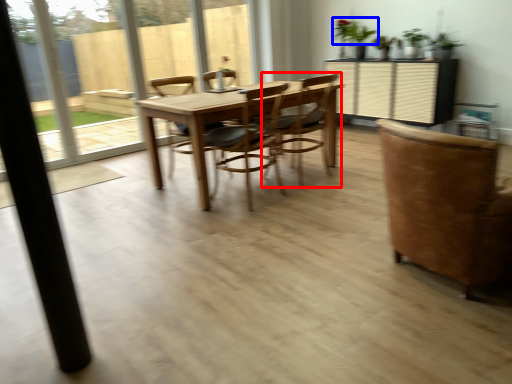
Question: Which point is further to the camera, chair (highlighted by a red box) or plant (highlighted by a blue box)?

Choices:
 (A) chair
 (B) plant

Answer: (B)